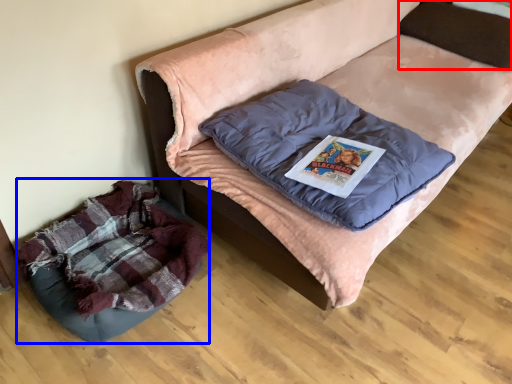
Question: Among these objects, which one is nearest to the camera, pillow (highlighted by a red box) or dog bed (highlighted by a blue box)?

Choices:
 (A) pillow
 (B) dog bed

Answer: (B)